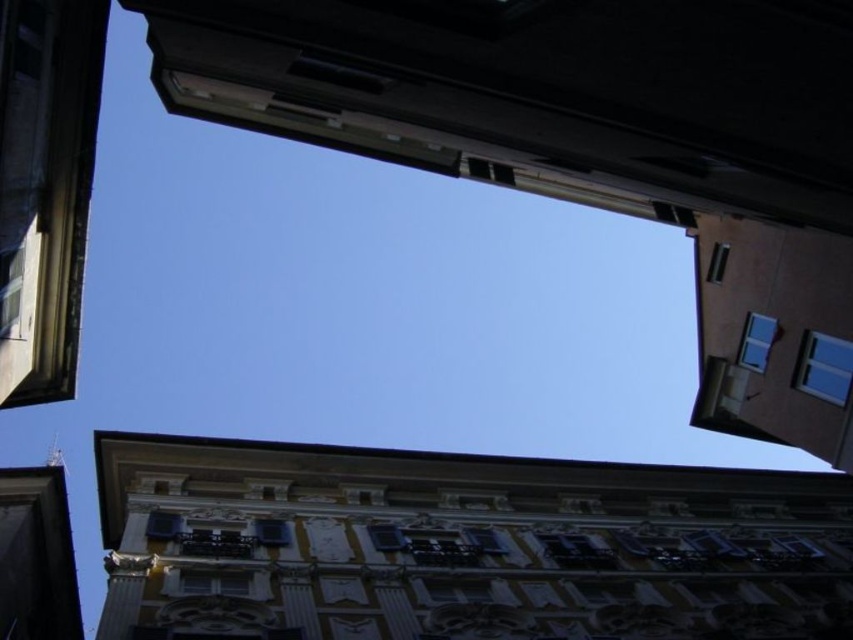
Does matte black window at lower center appear on the left side of clear glass window at upper right?

Correct, you'll find matte black window at lower center to the left of clear glass window at upper right.

Between matte black window at lower center and clear glass window at upper right, which one has more height?

clear glass window at upper right is taller.

Between point (549, 536) and point (764, 316), which one is positioned behind?

The point (764, 316) is more distant.

You are a GUI agent. You are given a task and a screenshot of the screen. Output one action in this format:
    pyautogui.click(x=<x>, y=<y>)
    Task: Click on the matte black window at lower center
    
    Given the screenshot: What is the action you would take?
    pyautogui.click(x=576, y=552)

Who is more forward, (111, 513) or (805, 332)?

Point (805, 332) is in front.

Is white textured building at center below transparent glass window at upper right?

Indeed, white textured building at center is positioned under transparent glass window at upper right.

The width and height of the screenshot is (853, 640). What do you see at coordinates (461, 545) in the screenshot? I see `white textured building at center` at bounding box center [461, 545].

Where is `white textured building at center`? The height and width of the screenshot is (640, 853). white textured building at center is located at coordinates (x=461, y=545).

This screenshot has width=853, height=640. What do you see at coordinates (824, 368) in the screenshot?
I see `transparent glass window at upper right` at bounding box center [824, 368].

The width and height of the screenshot is (853, 640). Describe the element at coordinates (824, 368) in the screenshot. I see `transparent glass window at upper right` at that location.

You are a GUI agent. You are given a task and a screenshot of the screen. Output one action in this format:
    pyautogui.click(x=<x>, y=<y>)
    Task: Click on the transparent glass window at upper right
    
    Given the screenshot: What is the action you would take?
    click(x=824, y=368)